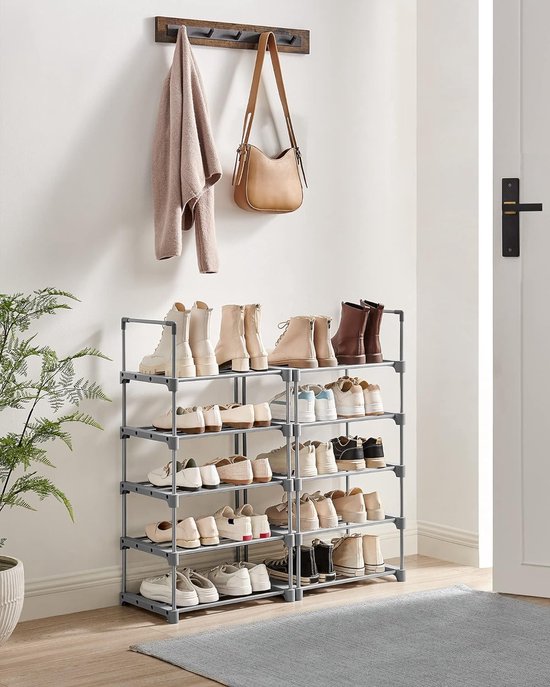
Find the location of a particular element. The height and width of the screenshot is (687, 550). shoes on second shelf is located at coordinates (179, 541), (210, 536), (238, 527), (258, 528), (306, 519), (334, 516), (360, 510), (373, 508).